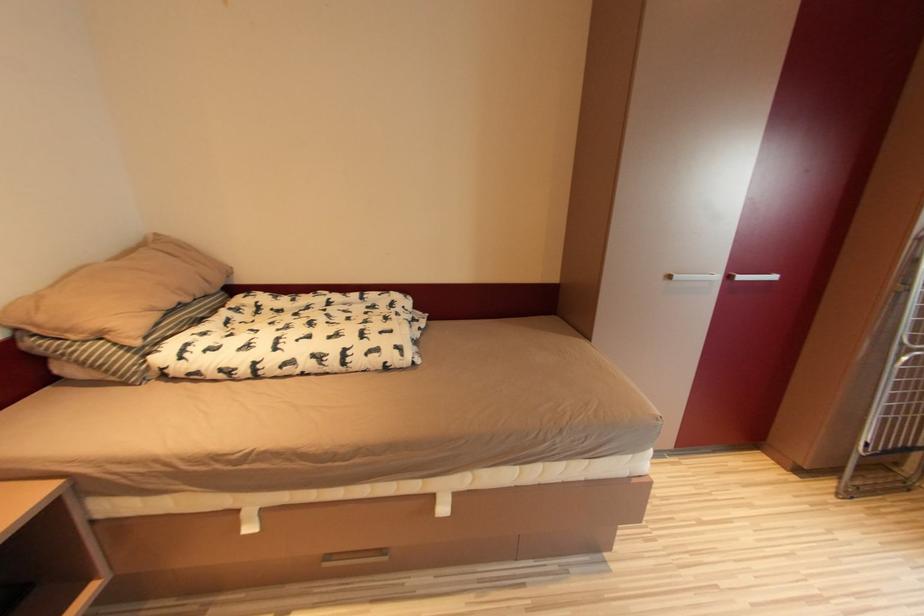
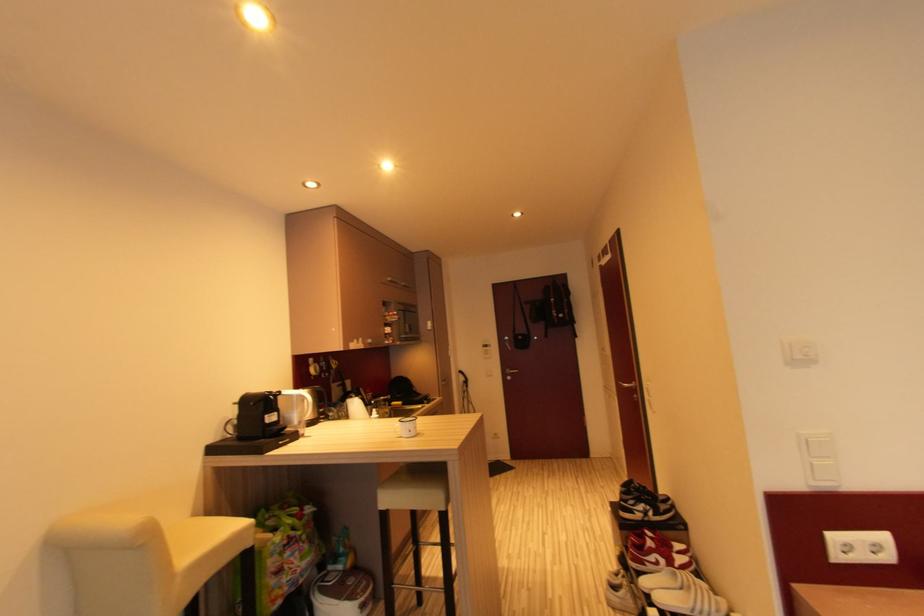
Question: The first image is from the beginning of the video and the second image is from the end. How did the camera likely rotate when shooting the video?

Choices:
 (A) Left
 (B) Right
 (C) Up
 (D) Down

Answer: (A)